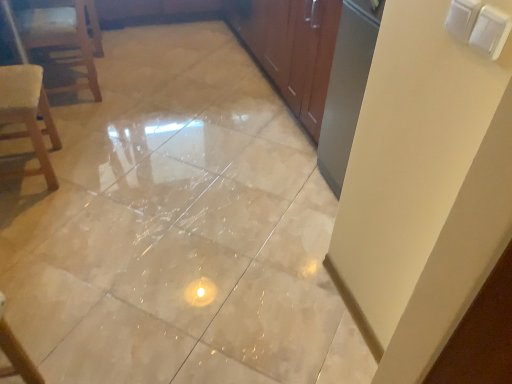
Where is `free space in front of wooden chair at left`? free space in front of wooden chair at left is located at coordinates (78, 122).